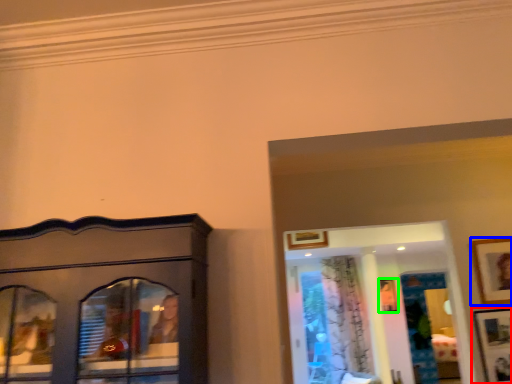
Question: Based on their relative distances, which object is farther from picture frame (highlighted by a red box)? Choose from picture frame (highlighted by a blue box) and picture frame (highlighted by a green box).

Choices:
 (A) picture frame
 (B) picture frame

Answer: (B)